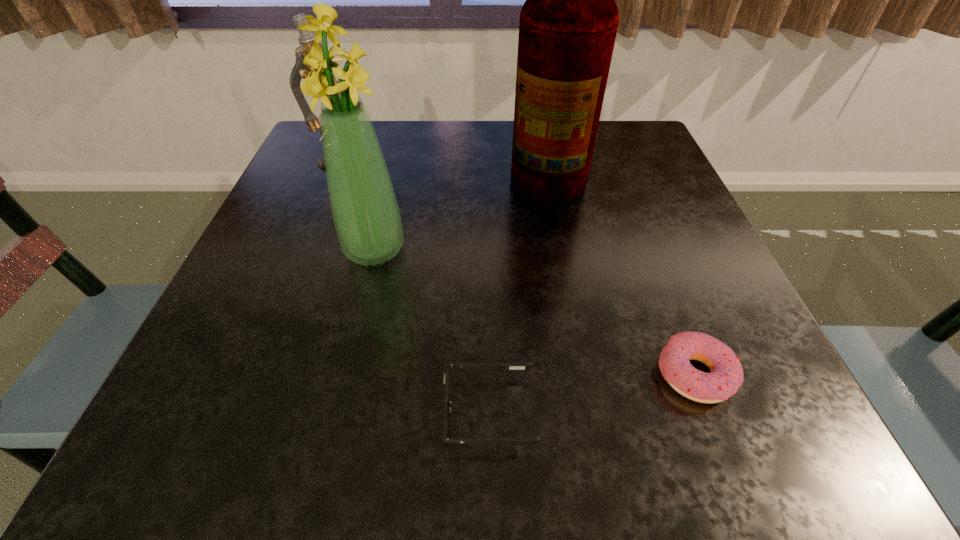
Find the location of a particular element. The image size is (960, 540). the tallest object is located at coordinates (568, 24).

At what (x,y) coordinates should I click in order to perform the action: click on bouquet. Please return your answer as a coordinate pair (x, y). The width and height of the screenshot is (960, 540). Looking at the image, I should click on (365, 211).

This screenshot has width=960, height=540. In order to click on the second tallest object in this screenshot , I will do `click(365, 211)`.

Identify the location of the third shortest object. (306, 39).

Where is `the rightmost object`? The height and width of the screenshot is (540, 960). the rightmost object is located at coordinates (726, 376).

Locate an element on the screen. doughnut is located at coordinates (726, 376).

Image resolution: width=960 pixels, height=540 pixels. I want to click on the shortest object, so click(514, 441).

Locate an element on the screen. This screenshot has height=540, width=960. free location located 0.260m at the nozzle of the fire extinguisher is located at coordinates (393, 170).

Image resolution: width=960 pixels, height=540 pixels. I want to click on blank area located at the nozzle of the fire extinguisher, so click(339, 170).

Where is `vacant point located 0.310m at the nozzle of the fire extinguisher`? vacant point located 0.310m at the nozzle of the fire extinguisher is located at coordinates (371, 170).